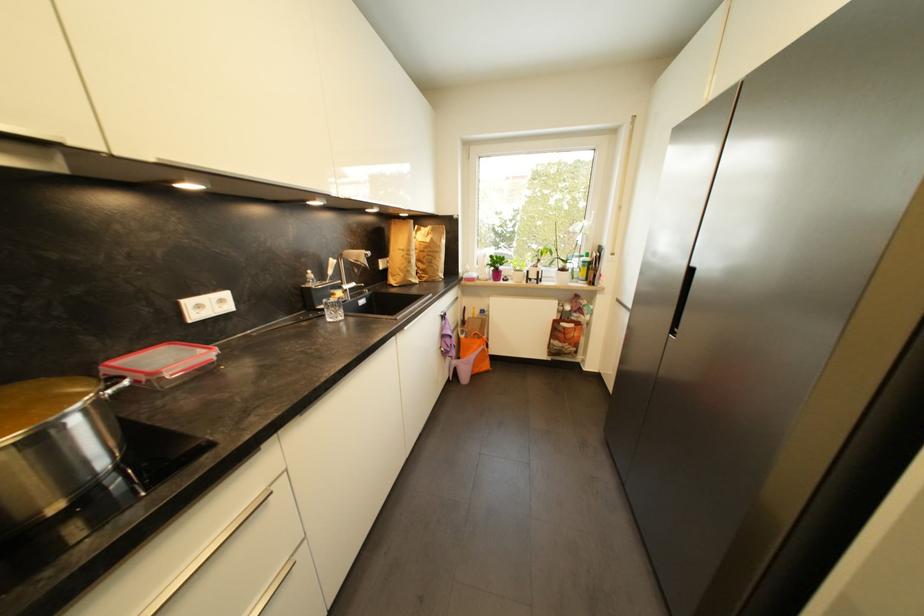
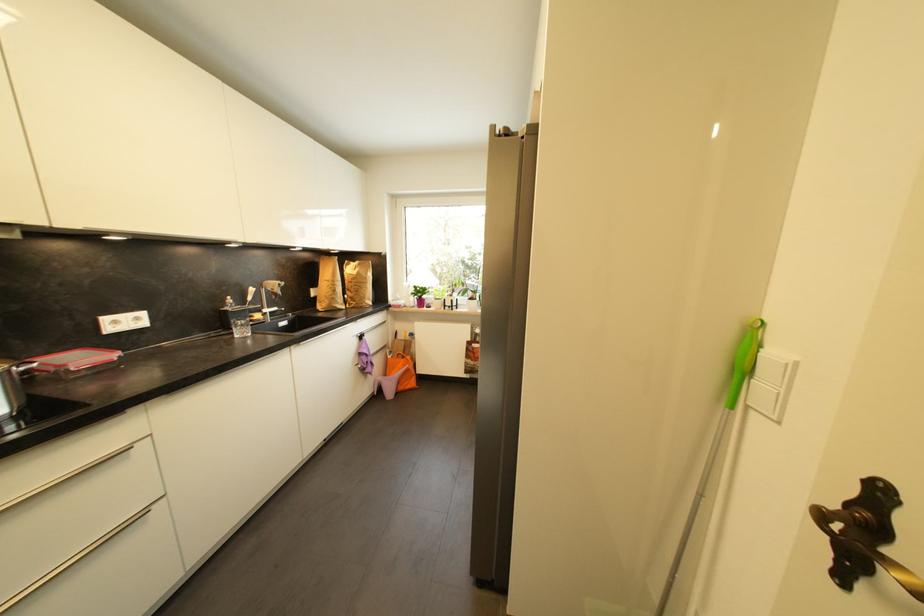
Where in the second image is the point corresponding to the point at 415,264 from the first image?

(339, 293)